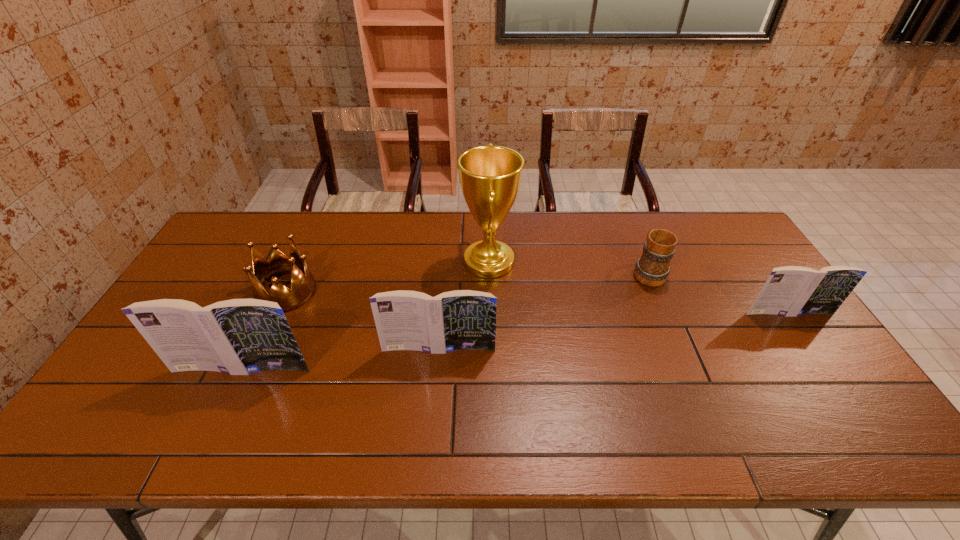
The image size is (960, 540). Identify the location of object located at the left edge. (239, 336).

This screenshot has width=960, height=540. Find the location of `object that is at the right edge`. object that is at the right edge is located at coordinates (789, 291).

Locate an element on the screen. The width and height of the screenshot is (960, 540). vacant point at the far edge is located at coordinates coord(550,217).

What are the coordinates of `free spot at the near edge of the desktop` in the screenshot? It's located at (372, 379).

In order to click on vacant area at the left edge of the desktop in this screenshot , I will do `click(211, 292)`.

Locate an element on the screen. The width and height of the screenshot is (960, 540). vacant space at the right edge is located at coordinates (743, 258).

Locate an element on the screen. The image size is (960, 540). free region at the far left corner of the desktop is located at coordinates (234, 218).

Identify the location of vacant area at the far right corner of the desktop. (686, 217).

In the image, there is a desktop. What are the coordinates of `vacant space at the near right corner` in the screenshot? It's located at (844, 387).

What are the coordinates of `unoccupied position between the tallest object and the mug` in the screenshot? It's located at (568, 267).